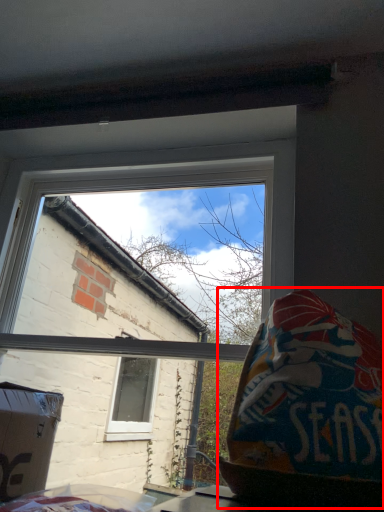
Question: Observing the image, what is the correct spatial positioning of bean bag chair (annotated by the red box) in reference to window?

Choices:
 (A) right
 (B) left

Answer: (A)